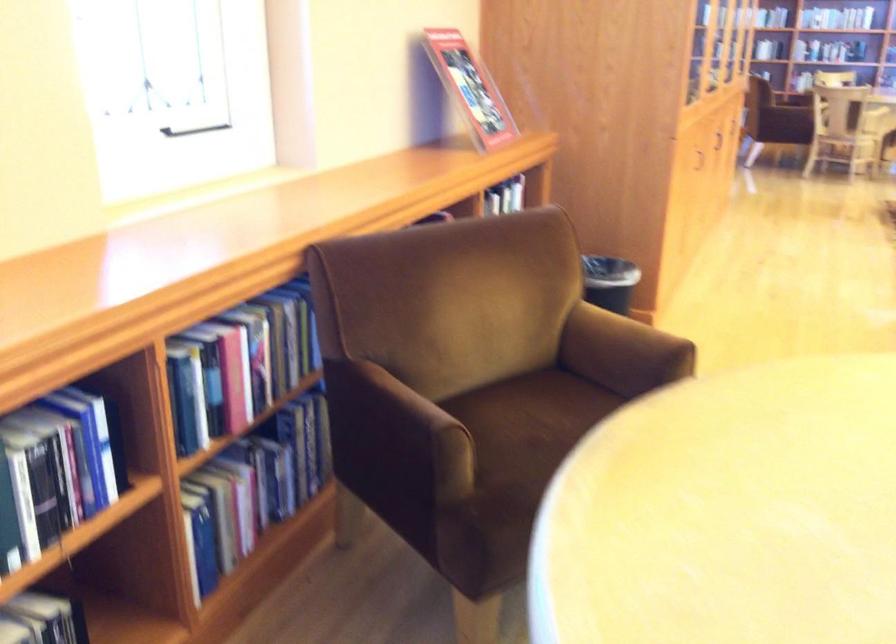
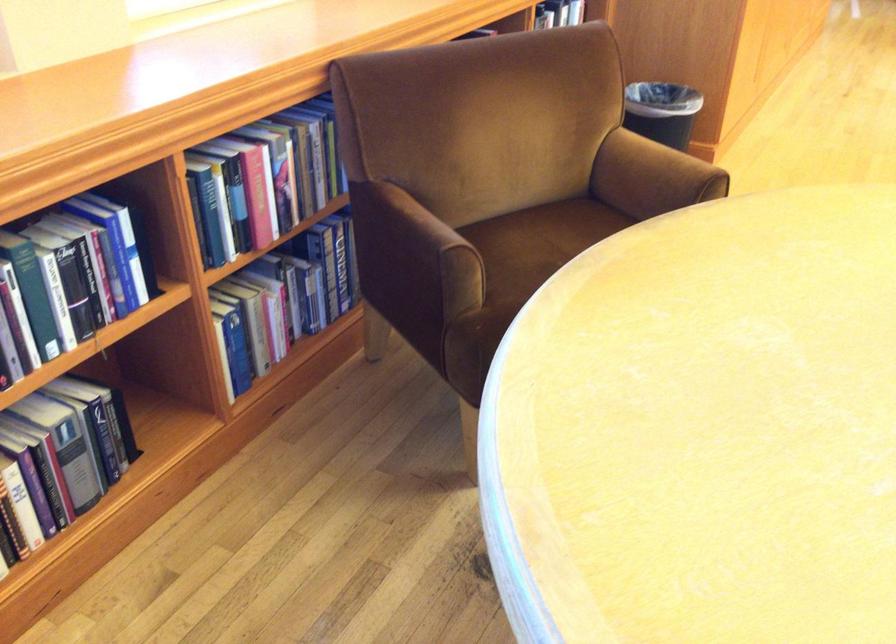
Find the pixel in the second image that matches (x=519, y=418) in the first image.

(538, 242)